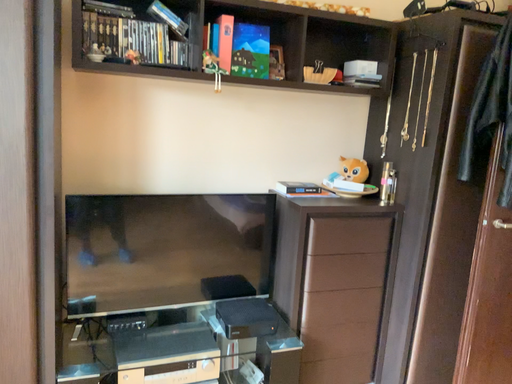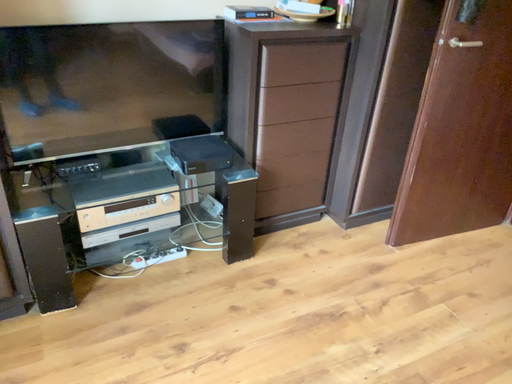
Question: How did the camera likely rotate when shooting the video?

Choices:
 (A) rotated upward
 (B) rotated downward

Answer: (B)